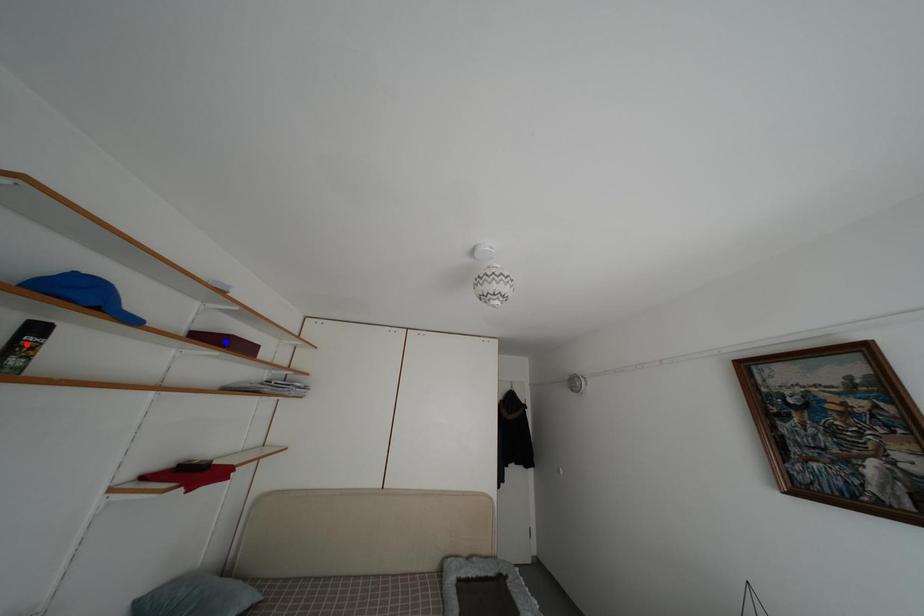
Question: Which of the two points in the image is closer to the camera?

Choices:
 (A) Blue point is closer.
 (B) Red point is closer.

Answer: (B)